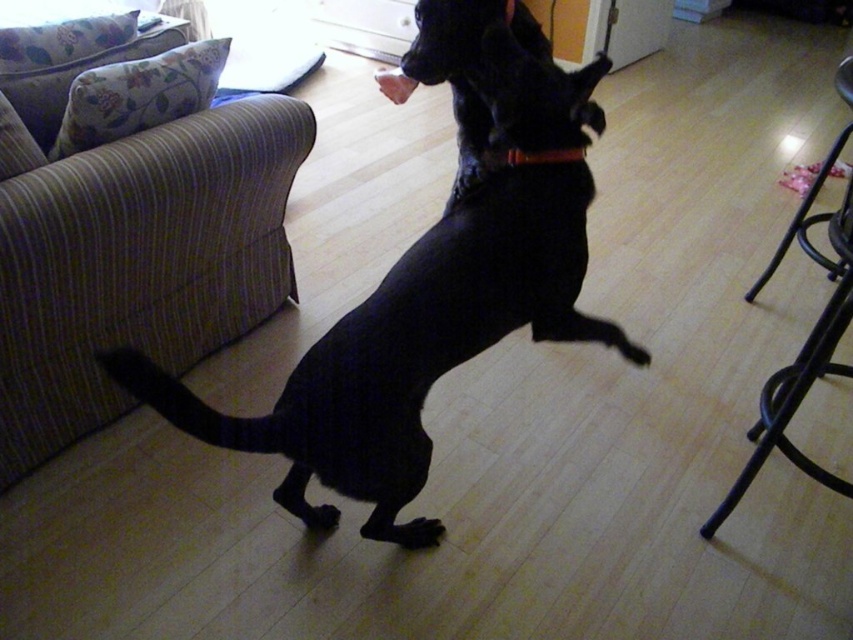
Question: Does black metal stool at lower right appear on the right side of black matte paw at lower center?

Choices:
 (A) yes
 (B) no

Answer: (A)

Question: Among these points, which one is nearest to the camera?

Choices:
 (A) (814, 186)
 (B) (434, 518)

Answer: (B)

Question: Which point is farther to the camera?

Choices:
 (A) (543, 156)
 (B) (547, 56)
 (C) (152, 384)
 (D) (804, 465)

Answer: (B)

Question: Can you confirm if black metal stool at lower right is positioned to the right of black leather neckband at center?

Choices:
 (A) no
 (B) yes

Answer: (B)

Question: Which point appears farthest from the camera in this image?

Choices:
 (A) (402, 524)
 (B) (308, 504)
 (C) (770, 387)
 (D) (531, 163)

Answer: (C)

Question: Can you confirm if black metal stool at lower right is positioned to the left of black matte paw at lower center?

Choices:
 (A) yes
 (B) no

Answer: (B)